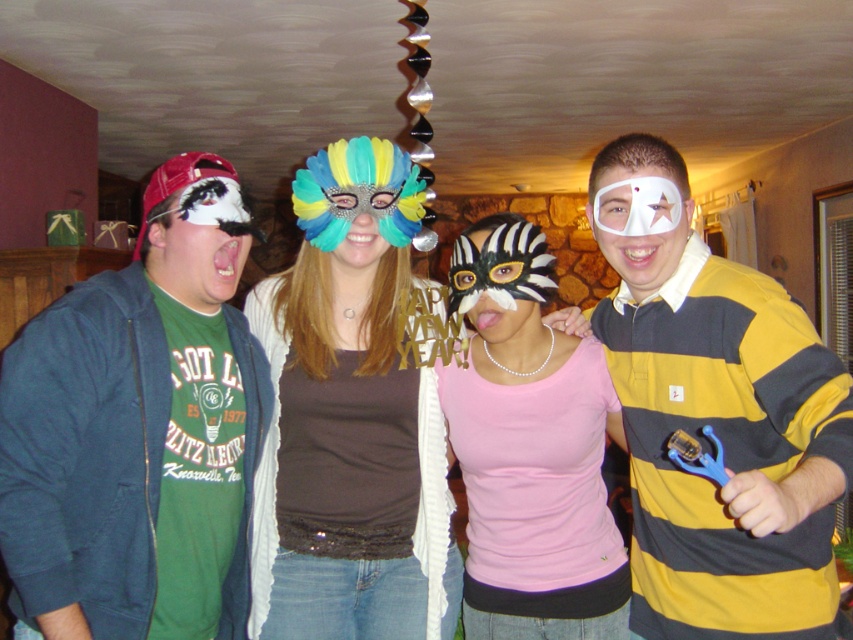
Question: Can you confirm if matte green t-shirt at left is wider than pink matte shirt at center?

Choices:
 (A) no
 (B) yes

Answer: (A)

Question: Which point appears closest to the camera in this image?

Choices:
 (A) (244, 259)
 (B) (674, 248)
 (C) (468, 317)

Answer: (B)

Question: Which object appears farthest from the camera in this image?

Choices:
 (A) brown fabric tank top at center
 (B) white paper mask at center

Answer: (A)

Question: From the image, what is the correct spatial relationship of pink matte shirt at center in relation to brown fabric tank top at center?

Choices:
 (A) above
 (B) below

Answer: (A)

Question: Can you confirm if multicolored feather mask at center is positioned to the right of zebra-patterned mask at center?

Choices:
 (A) yes
 (B) no

Answer: (B)

Question: Which object appears closest to the camera in this image?

Choices:
 (A) brown fabric tank top at center
 (B) multicolored feather mask at center
 (C) white paper mask at center

Answer: (C)